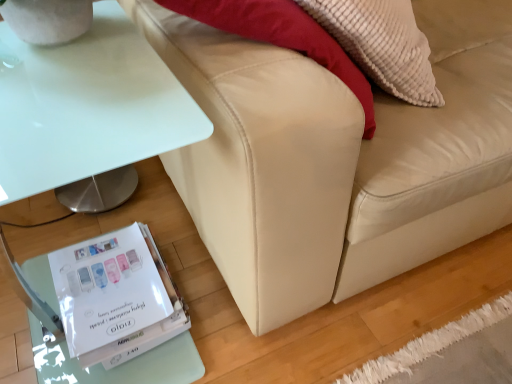
Locate an element on the screen. Image resolution: width=512 pixels, height=384 pixels. white glossy table at lower left is located at coordinates (88, 110).

In order to face white glossy paperback book at lower left, should I rotate leftwards or rightwards?

Turn left by 18.642 degrees to look at white glossy paperback book at lower left.

The height and width of the screenshot is (384, 512). In order to click on white glossy table at lower left in this screenshot , I will do `click(88, 110)`.

Can you confirm if beige leather couch at lower right is smaller than white glossy table at lower left?

Actually, beige leather couch at lower right might be larger than white glossy table at lower left.

From the image's perspective, does beige leather couch at lower right appear higher than white glossy table at lower left?

Yes, from the image's perspective, beige leather couch at lower right is above white glossy table at lower left.

Considering the positions of objects beige leather couch at lower right and white glossy table at lower left in the image provided, who is more to the left, beige leather couch at lower right or white glossy table at lower left?

Positioned to the left is white glossy table at lower left.

In the image, is beige leather couch at lower right positioned in front of or behind white glossy table at lower left?

In the image, beige leather couch at lower right appears in front of white glossy table at lower left.

From the image's perspective, which object appears higher, white glossy paperback book at lower left or white glossy table at lower left?

white glossy table at lower left, from the image's perspective.

From a real-world perspective, is white glossy paperback book at lower left under white glossy table at lower left?

Correct, in the physical world, white glossy paperback book at lower left is lower than white glossy table at lower left.

Does white glossy paperback book at lower left turn towards white glossy table at lower left?

Yes, white glossy paperback book at lower left is turned towards white glossy table at lower left.

Is white glossy paperback book at lower left next to beige leather couch at lower right and touching it?

No, white glossy paperback book at lower left is not in contact with beige leather couch at lower right.

Between white glossy paperback book at lower left and beige leather couch at lower right, which one has smaller width?

white glossy paperback book at lower left.

Could you tell me if white glossy paperback book at lower left is facing beige leather couch at lower right?

No.

Is the depth of white glossy paperback book at lower left less than that of beige leather couch at lower right?

That is False.

Find the location of `studio couch on the right side of white glossy table at lower left`. studio couch on the right side of white glossy table at lower left is located at coordinates (337, 159).

Which of these two, white glossy table at lower left or beige leather couch at lower right, stands shorter?

Standing shorter between the two is white glossy table at lower left.

Is white glossy table at lower left looking in the opposite direction of beige leather couch at lower right?

No, white glossy table at lower left is not facing the opposite direction of beige leather couch at lower right.

Is white glossy table at lower left in front of or behind beige leather couch at lower right in the image?

Visually, white glossy table at lower left is located behind beige leather couch at lower right.

Where is `table that is on the left side of white glossy paperback book at lower left`? Image resolution: width=512 pixels, height=384 pixels. table that is on the left side of white glossy paperback book at lower left is located at coordinates (88, 110).

Is white glossy table at lower left inside the boundaries of white glossy paperback book at lower left, or outside?

white glossy table at lower left exists outside the volume of white glossy paperback book at lower left.

Is white glossy table at lower left positioned with its back to white glossy paperback book at lower left?

No, white glossy table at lower left is not facing the opposite direction of white glossy paperback book at lower left.

Can you tell me how much beige leather couch at lower right and white glossy paperback book at lower left differ in facing direction?

The facing directions of beige leather couch at lower right and white glossy paperback book at lower left are 0.553 degrees apart.

How distant is beige leather couch at lower right from white glossy paperback book at lower left?

beige leather couch at lower right is 16.55 inches from white glossy paperback book at lower left.

From a real-world perspective, is beige leather couch at lower right located beneath white glossy paperback book at lower left?

No, from a real-world perspective, beige leather couch at lower right is not beneath white glossy paperback book at lower left.

Is point (404, 174) closer to viewer compared to point (68, 285)?

Yes.

The width and height of the screenshot is (512, 384). Identify the location of table behind the beige leather couch at lower right. (88, 110).

You are a GUI agent. You are given a task and a screenshot of the screen. Output one action in this format:
    pyautogui.click(x=<x>, y=<y>)
    Task: Click on the table lying in front of the white glossy paperback book at lower left
    Image resolution: width=512 pixels, height=384 pixels.
    Given the screenshot: What is the action you would take?
    pyautogui.click(x=88, y=110)

From the image, which object appears to be nearer to white glossy table at lower left, white glossy paperback book at lower left or beige leather couch at lower right?

Based on the image, beige leather couch at lower right appears to be nearer to white glossy table at lower left.

From the image, which object appears to be nearer to beige leather couch at lower right, white glossy paperback book at lower left or white glossy table at lower left?

white glossy table at lower left.

From the image, which object appears to be nearer to white glossy paperback book at lower left, white glossy table at lower left or beige leather couch at lower right?

Among the two, beige leather couch at lower right is located nearer to white glossy paperback book at lower left.

Looking at the image, which one is located closer to beige leather couch at lower right, white glossy table at lower left or white glossy paperback book at lower left?

white glossy table at lower left is closer to beige leather couch at lower right.

When comparing their distances from white glossy table at lower left, does beige leather couch at lower right or white glossy paperback book at lower left seem closer?

beige leather couch at lower right is positioned closer to the anchor white glossy table at lower left.

Considering their positions, is beige leather couch at lower right positioned further to white glossy paperback book at lower left than white glossy table at lower left?

white glossy table at lower left is positioned further to the anchor white glossy paperback book at lower left.

At what (x,y) coordinates should I click in order to perform the action: click on paperback book situated between white glossy table at lower left and beige leather couch at lower right from left to right. Please return your answer as a coordinate pair (x, y). This screenshot has height=384, width=512. Looking at the image, I should click on (116, 297).